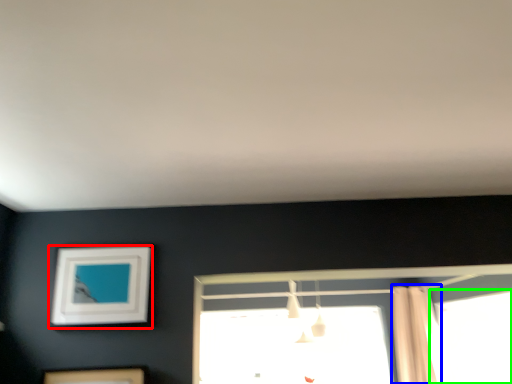
Question: Which object is the farthest from picture frame (highlighted by a red box)? Choose among these: shower curtain (highlighted by a blue box) or window (highlighted by a green box).

Choices:
 (A) shower curtain
 (B) window

Answer: (B)